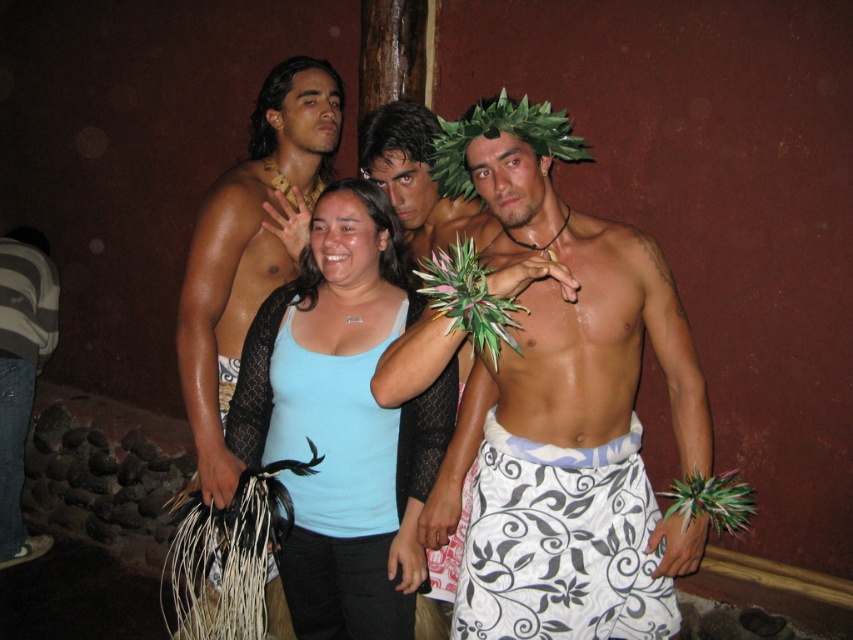
You are a photographer trying to capture a balanced composition. The white printed sarong at center and the denim jeans at lower left are part of the scene. Based on their positions and sizes, which clothing item should you focus on to maintain visual balance?

The white printed sarong at center has a lesser height compared to denim jeans at lower left. To maintain visual balance, focus on the denim jeans at lower left since it is taller and might draw more attention.

You are a photographer at the event and want to capture a closeup of the shiny gold necklace at left and white floral sarong at center. Since you can only focus on one object at a time, which one should you choose to ensure the other is still in the background?

The shiny gold necklace at left has a greater height compared to the white floral sarong at center, so focusing on the taller shiny gold necklace at left will keep the shorter white floral sarong at center in the background.

You are at a cultural event and need to find the white printed fabric skirt at center and the denim jeans at lower left. From the perspective of someone standing in front of the scene, which object is positioned to the right?

The white printed fabric skirt at center is to the right of denim jeans at lower left.